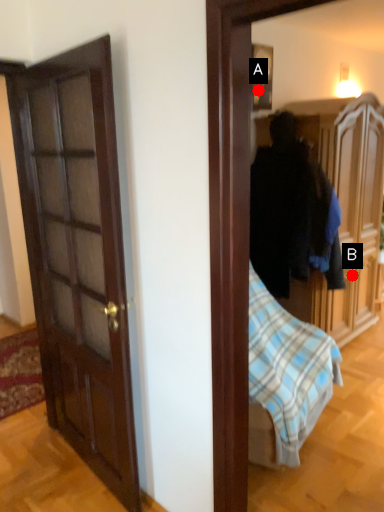
Question: Two points are circled on the image, labeled by A and B beside each circle. Which of the following is the closest to the observer?

Choices:
 (A) A is closer
 (B) B is closer

Answer: (A)